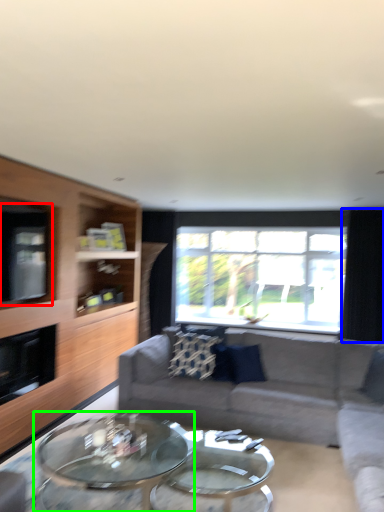
Question: Estimate the real-world distances between objects in this image. Which object is farther from window screen (highlighted by a red box), curtain (highlighted by a blue box) or coffee table (highlighted by a green box)?

Choices:
 (A) curtain
 (B) coffee table

Answer: (A)